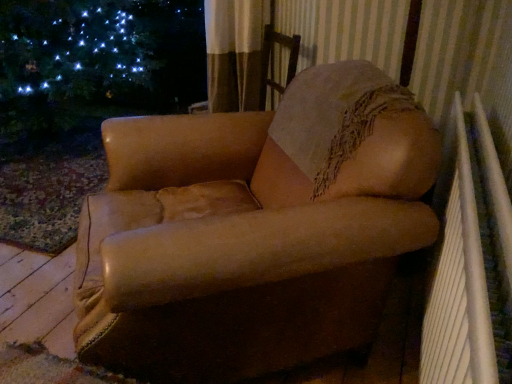
Image resolution: width=512 pixels, height=384 pixels. What do you see at coordinates (254, 230) in the screenshot? I see `leather armchair at center` at bounding box center [254, 230].

Locate an element on the screen. This screenshot has width=512, height=384. leather armchair at center is located at coordinates (254, 230).

Locate an element on the screen. The width and height of the screenshot is (512, 384). leather armchair at center is located at coordinates (254, 230).